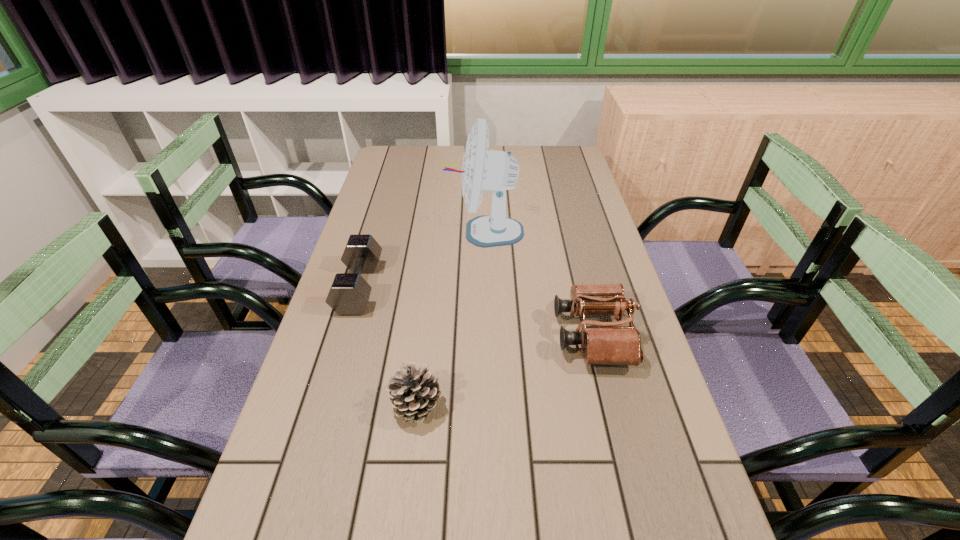
Where is `free spot located through the eyepieces of the binoculars`? This screenshot has height=540, width=960. free spot located through the eyepieces of the binoculars is located at coordinates (421, 335).

Identify the location of vacant area situated through the eyepieces of the binoculars. This screenshot has width=960, height=540. (536, 335).

Locate an element on the screen. vacant space located on the right of the pinecone is located at coordinates (595, 405).

Where is `free point located 0.380m on the right of the dumbbell`? This screenshot has width=960, height=540. free point located 0.380m on the right of the dumbbell is located at coordinates (518, 287).

Find the location of a particular element. The height and width of the screenshot is (540, 960). object that is positioned at the left edge is located at coordinates (349, 294).

Locate an element on the screen. object situated at the right edge is located at coordinates (609, 344).

You are a GUI agent. You are given a task and a screenshot of the screen. Output one action in this format:
    pyautogui.click(x=<x>, y=<y>)
    Task: Click on the vacant space at the left edge of the desktop
    This screenshot has height=540, width=960.
    Given the screenshot: What is the action you would take?
    pyautogui.click(x=387, y=185)

Find the location of a particular element. The width and height of the screenshot is (960, 540). vacant region at the right edge is located at coordinates (599, 233).

What are the coordinates of `vacant space at the far left corner` in the screenshot? It's located at (416, 157).

Locate an element on the screen. The height and width of the screenshot is (540, 960). free space between the shortest object and the binoculars is located at coordinates (476, 311).